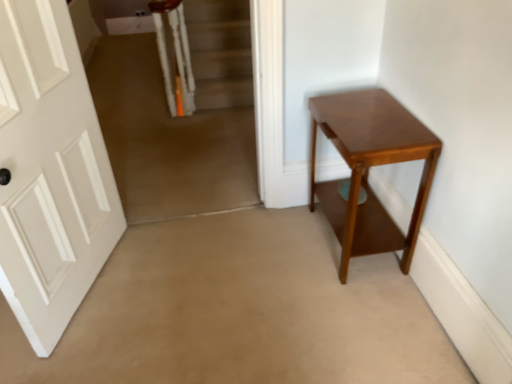
Locate an element on the screen. The image size is (512, 384). vacant region below carpeted stairs at upper left (from a real-world perspective) is located at coordinates click(195, 205).